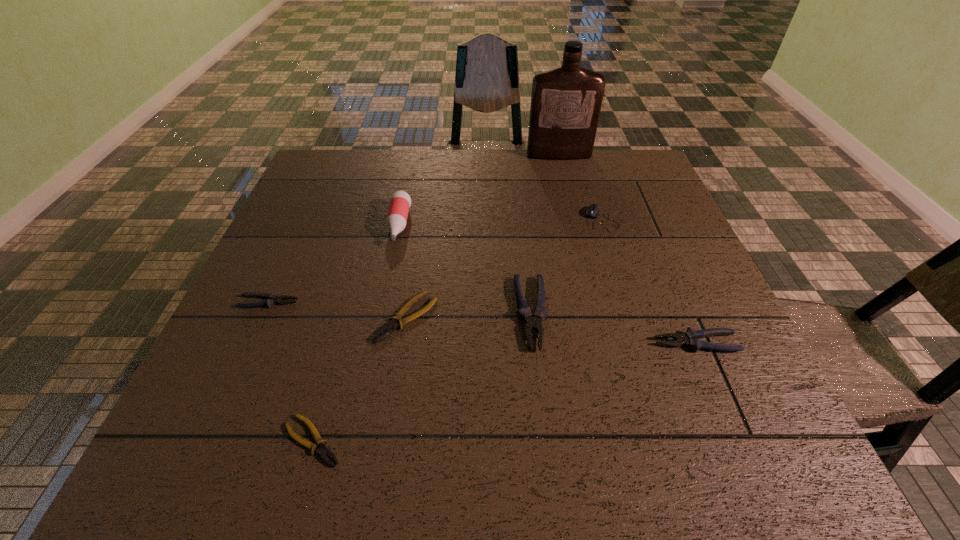
Locate an element on the screen. Image resolution: width=960 pixels, height=540 pixels. vacant space located 0.110m at the gripping part of the rightmost gray pliers is located at coordinates [x=600, y=343].

Identify the location of free space located at the gripping part of the rightmost gray pliers. Image resolution: width=960 pixels, height=540 pixels. (585, 343).

Find the location of a particular element. The image size is (960, 540). free space located at the gripping part of the third shortest pliers is located at coordinates (334, 302).

This screenshot has width=960, height=540. Identify the location of vacant area located 0.090m on the back of the second shortest object. (415, 266).

You are a GUI agent. You are given a task and a screenshot of the screen. Output one action in this format:
    pyautogui.click(x=<x>, y=<y>)
    Task: Click on the free space located 0.080m on the left of the smaller yellow pliers
    The image size is (960, 540).
    Given the screenshot: What is the action you would take?
    pyautogui.click(x=234, y=441)

I want to click on object at the far edge, so click(566, 102).

The height and width of the screenshot is (540, 960). I want to click on object present at the near edge, so click(322, 451).

You are a GUI agent. You are given a task and a screenshot of the screen. Output one action in this format:
    pyautogui.click(x=<x>, y=<y>)
    Task: Click on the object at the left edge
    
    Given the screenshot: What is the action you would take?
    pyautogui.click(x=271, y=299)

You are a GUI agent. You are given a task and a screenshot of the screen. Output one action in this format:
    pyautogui.click(x=<x>, y=<y>)
    Task: Click on the computer mouse that is at the right edge
    The height and width of the screenshot is (540, 960).
    Given the screenshot: What is the action you would take?
    pyautogui.click(x=592, y=211)

Find the location of a particular element. The height and width of the screenshot is (540, 960). pliers located in the right edge section of the desktop is located at coordinates (690, 338).